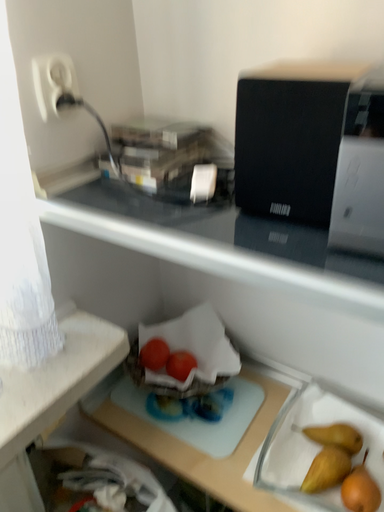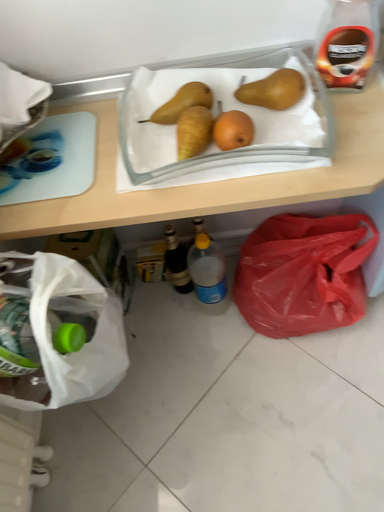
Question: How did the camera likely rotate when shooting the video?

Choices:
 (A) rotated left
 (B) rotated right

Answer: (B)